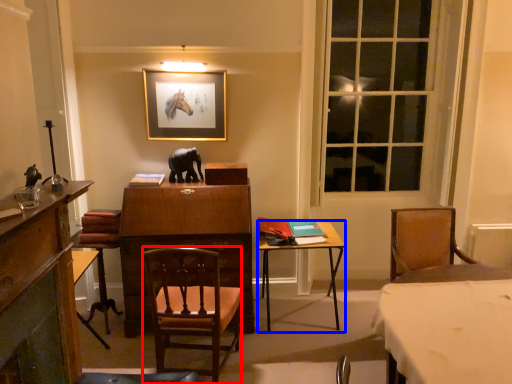
Question: Which object is closer to the camera taking this photo, chair (highlighted by a red box) or table (highlighted by a blue box)?

Choices:
 (A) chair
 (B) table

Answer: (A)